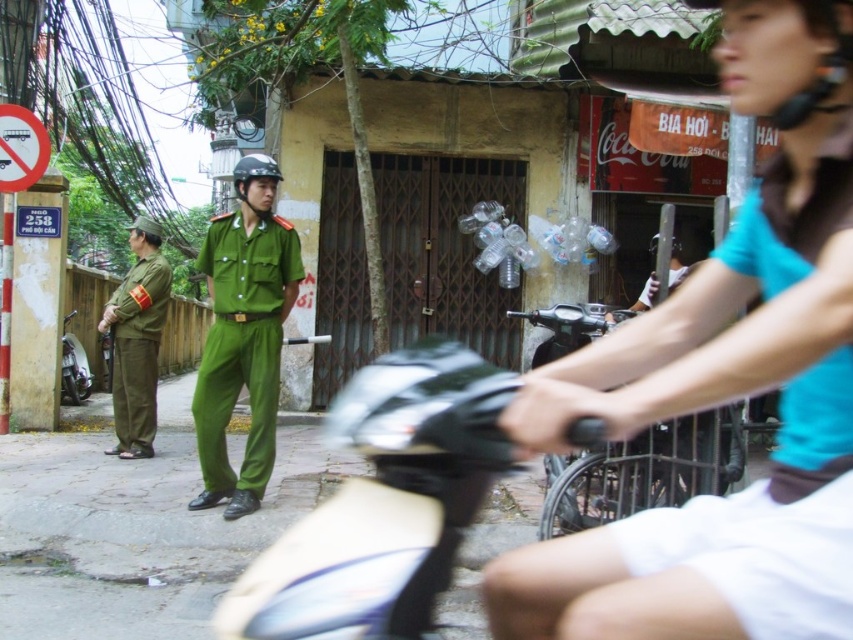
Can you confirm if green uniform at center is smaller than black matte helmet at center?

Incorrect, green uniform at center is not smaller in size than black matte helmet at center.

Is green uniform at center in front of black matte helmet at center?

Yes, it is.

Locate an element on the screen. green uniform at center is located at coordinates (242, 333).

Is blue fabric shirt at center to the right of black matte helmet at center from the viewer's perspective?

Indeed, blue fabric shirt at center is positioned on the right side of black matte helmet at center.

Can you confirm if blue fabric shirt at center is taller than black matte helmet at center?

Yes.

This screenshot has width=853, height=640. I want to click on blue fabric shirt at center, so click(x=724, y=385).

Is point (680, 538) in front of point (112, 312)?

That is True.

Between point (683, 621) and point (125, 333), which one is positioned in front?

Point (683, 621) is in front.

The width and height of the screenshot is (853, 640). What are the coordinates of `blue fabric shirt at center` in the screenshot? It's located at (724, 385).